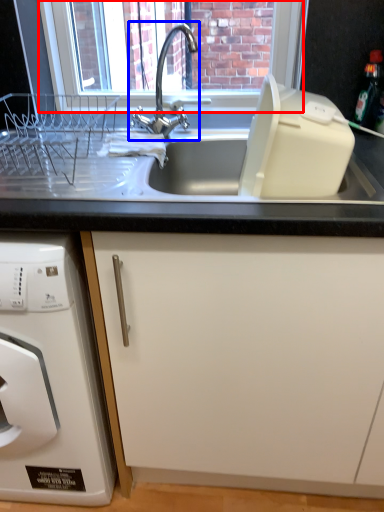
Question: Among these objects, which one is nearest to the camera, window screen (highlighted by a red box) or tap (highlighted by a blue box)?

Choices:
 (A) window screen
 (B) tap

Answer: (B)